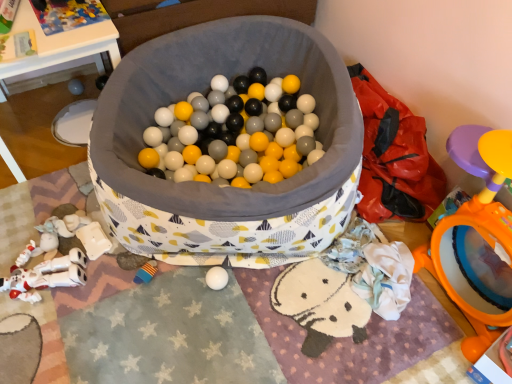
At what (x,y) coordinates should I click in order to perform the action: click on vacant space to the right of soft plush toy at lower left, positioned as the 5th toy in top-to-bottom order. Please return your answer as a coordinate pair (x, y). This screenshot has height=384, width=512. Looking at the image, I should click on (188, 297).